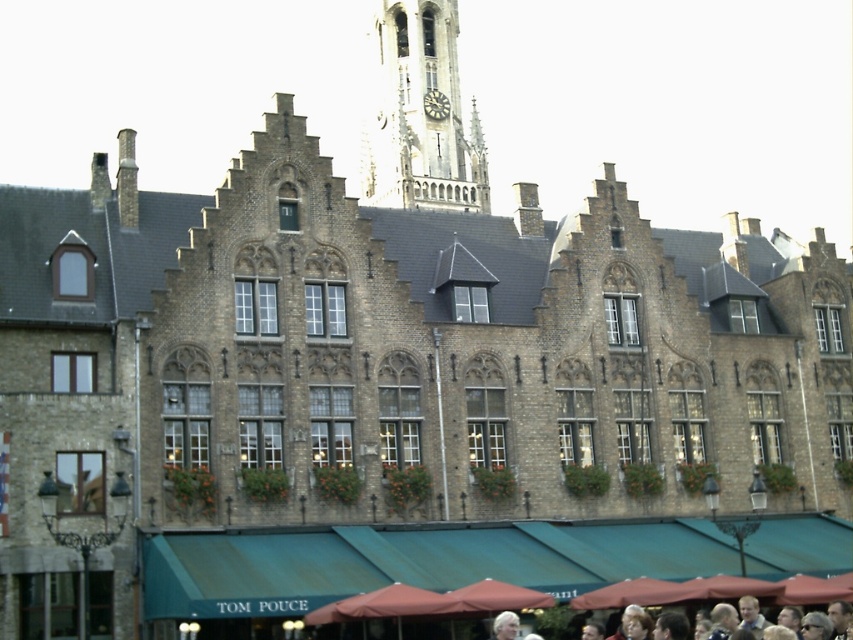
You are standing in front of the European building and want to take a photo of both the stone clock tower at upper center and the dark gray stone clock at center. Which one will appear larger in your photo?

The stone clock tower at upper center will appear larger in the photo because it is closer to the viewer than the dark gray stone clock at center.

What are the coordinates of the stone clock tower at upper center in the image?

The coordinates of the stone clock tower at upper center are at point (421,115).

You are an architect examining the European building. You notice the stone clock tower at upper center and the dark gray stone clock at center. Which one has a greater width?

The stone clock tower at upper center has a greater width than the dark gray stone clock at center.